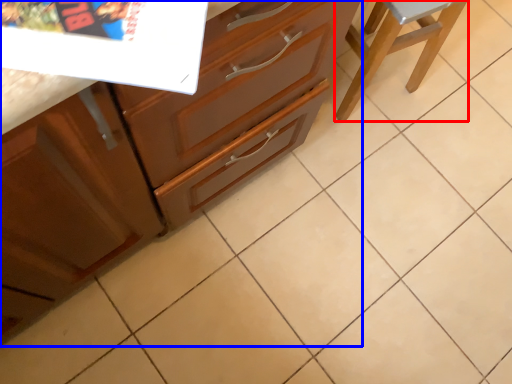
Question: Among these objects, which one is nearest to the camera, furniture (highlighted by a red box) or cabinetry (highlighted by a blue box)?

Choices:
 (A) furniture
 (B) cabinetry

Answer: (B)